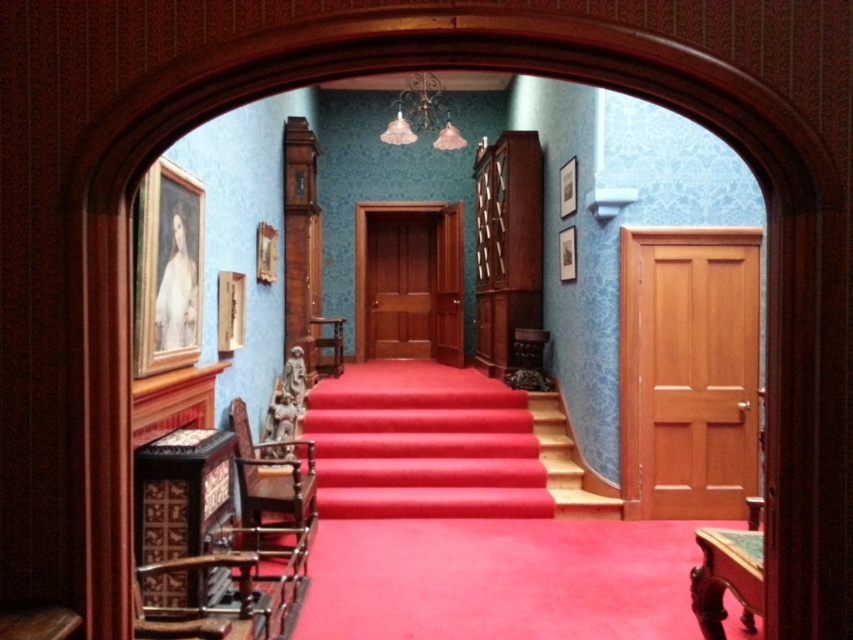
Question: Which of the following is the closest to the observer?

Choices:
 (A) wooden at center
 (B) velvet red carpet at center

Answer: (A)

Question: Which point appears farthest from the camera in this image?

Choices:
 (A) (428, 452)
 (B) (560, 445)

Answer: (B)

Question: Is velvet red carpet at center further to camera compared to wooden at center?

Choices:
 (A) no
 (B) yes

Answer: (B)

Question: Can you confirm if velvet red carpet at center is smaller than wooden at center?

Choices:
 (A) yes
 (B) no

Answer: (B)

Question: Which point appears closest to the camera in this image?

Choices:
 (A) (514, 458)
 (B) (608, 509)

Answer: (B)

Question: Is velvet red carpet at center closer to camera compared to wooden at center?

Choices:
 (A) yes
 (B) no

Answer: (B)